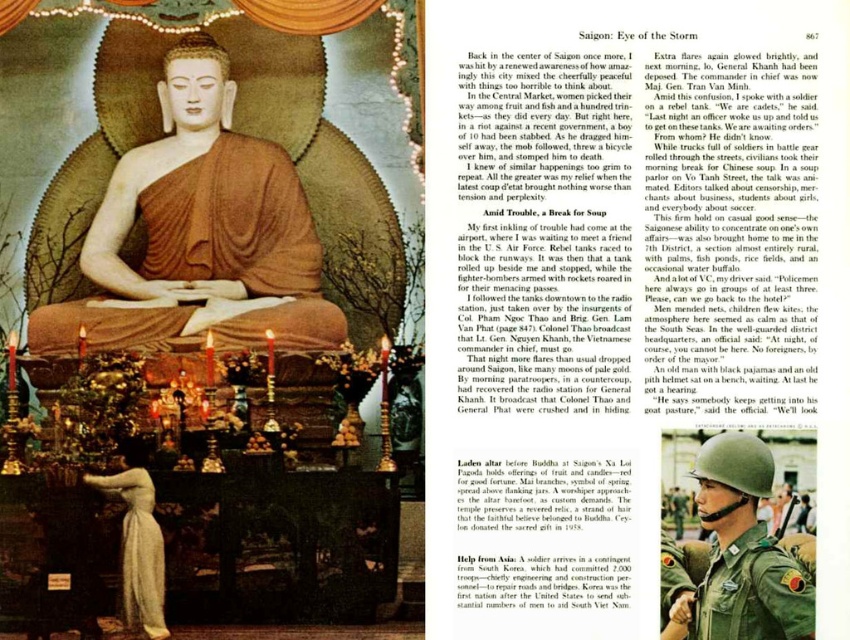
You are standing in front of the altar in the left side photograph of the image. You see a matte gold statue at center and a green uniform helmet at center. Which object is positioned higher?

The matte gold statue at center is above the green uniform helmet at center, so the statue is higher.

Looking at this image, you are standing in front of the altar with two helmets in front of you. The green uniform helmet at center and the green fabric helmet at center. Which helmet is positioned to the left?

The green uniform helmet at center is positioned to the left of the green fabric helmet at center.